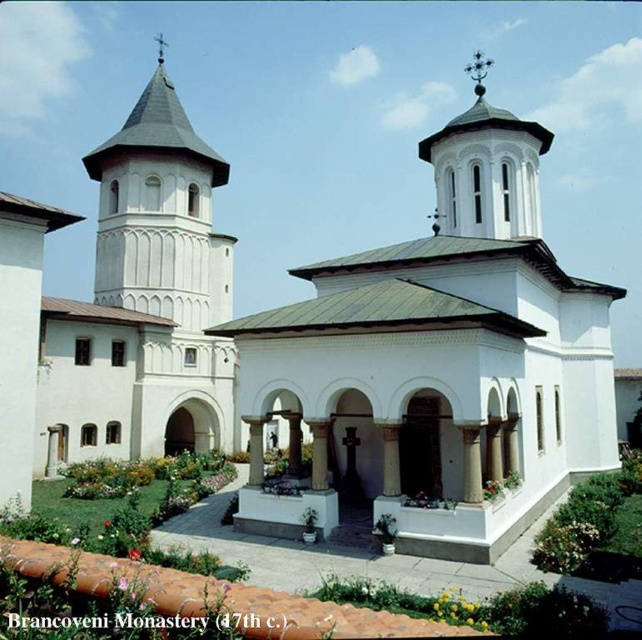
Question: Where is white smooth chapel at center located in relation to white stucco tower at left in the image?

Choices:
 (A) above
 (B) below

Answer: (B)

Question: Does white stucco tower at left appear under white stucco tower at upper center?

Choices:
 (A) no
 (B) yes

Answer: (A)

Question: Which of the following is the closest to the observer?

Choices:
 (A) white smooth chapel at center
 (B) white stucco tower at left
 (C) white stucco tower at upper center

Answer: (A)

Question: Can you confirm if white stucco tower at left is positioned to the right of white stucco tower at upper center?

Choices:
 (A) yes
 (B) no

Answer: (B)

Question: Which point is farther to the camera?

Choices:
 (A) white stucco tower at upper center
 (B) white stucco tower at left
 (C) white smooth chapel at center

Answer: (B)

Question: Which point is closer to the camera taking this photo?

Choices:
 (A) (388, 461)
 (B) (482, 156)
 (C) (229, 292)

Answer: (A)